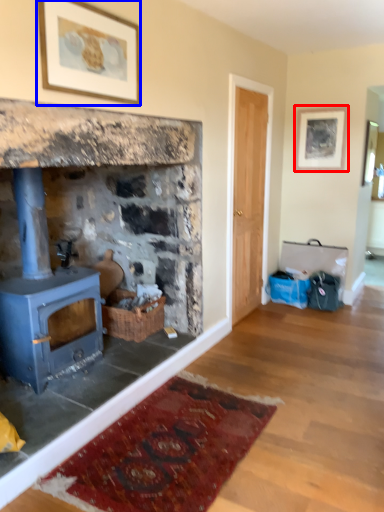
Question: Which of the following is the closest to the observer, picture frame (highlighted by a red box) or picture frame (highlighted by a blue box)?

Choices:
 (A) picture frame
 (B) picture frame

Answer: (B)